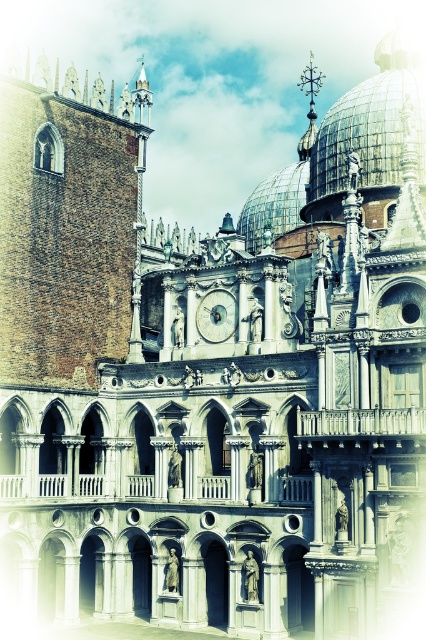
You are an architect analyzing the symmetry of the building. The shiny silver dome at upper right is represented by point [368,134]. Is there another point on the building that mirrors this position across the central axis?

The shiny silver dome at upper right is represented by point [368,134]. Since the building has a central axis symmetry, there should be a mirrored point on the left side at approximately 0.789, 0.866.

You are standing in front of the grand building and want to take a photo that includes both the shiny silver dome at upper right and the silver metallic clock at center. Based on their positions, which object should be placed on the right side of the photo to include both?

The shiny silver dome at upper right should be placed on the right side of the photo because it is located to the right of the silver metallic clock at center.

You are standing in front of the grand building and want to determine the relative positions of two specific points marked on the facade. The first point is located at coordinates point (422,100), and the second is at point (221,289). Which point is closer to your current position?

Point (422,100) is closer to your current position because it is further to the viewer than point (221,289).